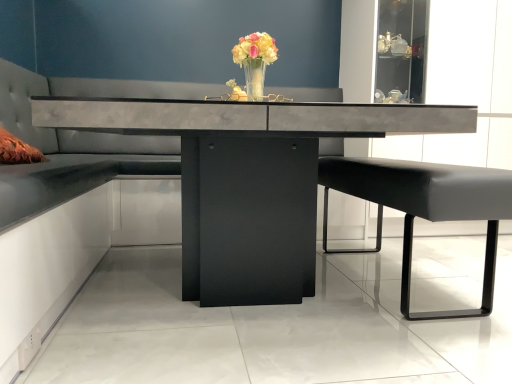
Question: Is translucent glass vase at center shorter than black leather bench at right?

Choices:
 (A) yes
 (B) no

Answer: (A)

Question: From a real-world perspective, is translucent glass vase at center located higher than black leather bench at right?

Choices:
 (A) no
 (B) yes

Answer: (B)

Question: Can you confirm if translucent glass vase at center is smaller than black leather bench at right?

Choices:
 (A) yes
 (B) no

Answer: (A)

Question: Considering the relative positions of translucent glass vase at center and black leather bench at right in the image provided, is translucent glass vase at center behind black leather bench at right?

Choices:
 (A) yes
 (B) no

Answer: (A)

Question: Does translucent glass vase at center come in front of black leather bench at right?

Choices:
 (A) yes
 (B) no

Answer: (B)

Question: Can you confirm if translucent glass vase at center is wider than black leather bench at right?

Choices:
 (A) yes
 (B) no

Answer: (B)

Question: Does concrete table at center come behind tufted leather couch at center?

Choices:
 (A) yes
 (B) no

Answer: (B)

Question: Does concrete table at center have a lesser height compared to tufted leather couch at center?

Choices:
 (A) no
 (B) yes

Answer: (B)

Question: Is concrete table at center far from tufted leather couch at center?

Choices:
 (A) no
 (B) yes

Answer: (A)

Question: From the image's perspective, would you say concrete table at center is shown under tufted leather couch at center?

Choices:
 (A) yes
 (B) no

Answer: (A)

Question: Is concrete table at center facing away from tufted leather couch at center?

Choices:
 (A) no
 (B) yes

Answer: (A)

Question: Is concrete table at center oriented towards tufted leather couch at center?

Choices:
 (A) no
 (B) yes

Answer: (A)

Question: From a real-world perspective, is concrete table at center below black leather bench at right?

Choices:
 (A) no
 (B) yes

Answer: (A)